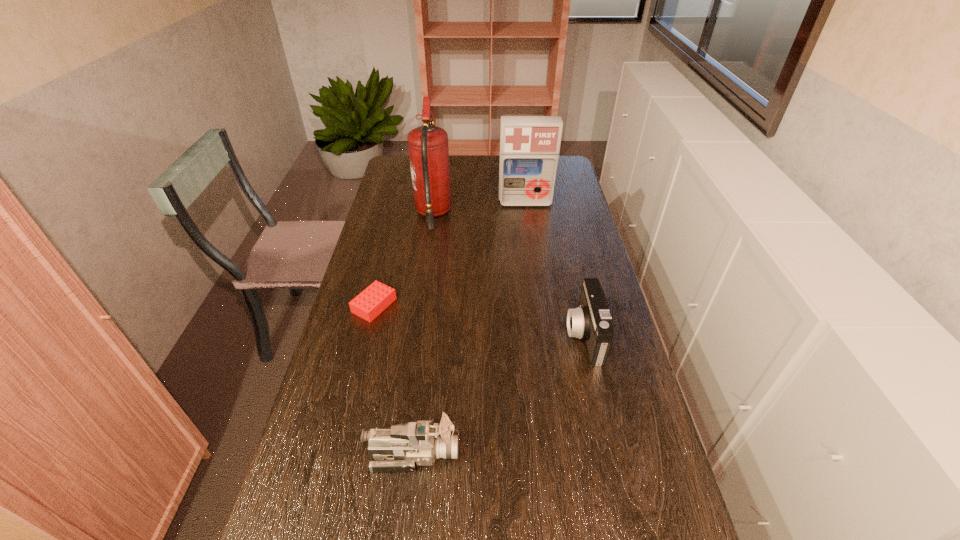
Where is `free location located 0.320m on the lens of the right camcorder`? free location located 0.320m on the lens of the right camcorder is located at coordinates (454, 335).

This screenshot has width=960, height=540. Identify the location of vacant area situated 0.200m on the lens of the right camcorder. (496, 335).

Locate an element on the screen. vacant space situated on the front-facing side of the nearer camcorder is located at coordinates (552, 454).

The height and width of the screenshot is (540, 960). Find the location of `vacant space situated 0.210m on the back of the leftmost object`. vacant space situated 0.210m on the back of the leftmost object is located at coordinates coord(389,248).

This screenshot has width=960, height=540. I want to click on fire extinguisher that is at the left edge, so click(428, 145).

Where is `camcorder that is at the left edge`? The height and width of the screenshot is (540, 960). camcorder that is at the left edge is located at coordinates (399, 449).

Where is `Lego located at the left edge`? Lego located at the left edge is located at coordinates (373, 300).

You are a GUI agent. You are given a task and a screenshot of the screen. Output one action in this format:
    pyautogui.click(x=<x>, y=<y>)
    Task: Click on the first-aid kit located at the right edge
    
    Given the screenshot: What is the action you would take?
    pyautogui.click(x=529, y=145)

Identify the location of camcorder present at the right edge. (591, 320).

The height and width of the screenshot is (540, 960). In the image, there is a desktop. In order to click on vacant region at the far edge in this screenshot , I will do `click(490, 182)`.